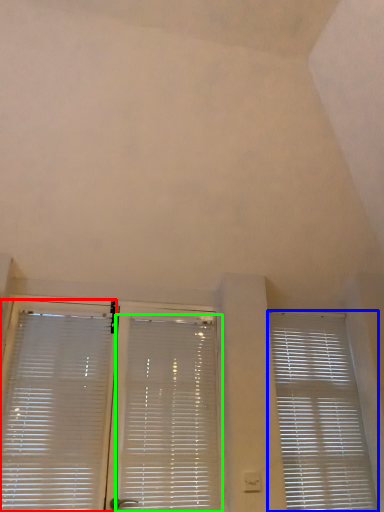
Question: Which object is the closest to the window blind (highlighted by a red box)? Choose among these: window blind (highlighted by a blue box) or window blind (highlighted by a green box).

Choices:
 (A) window blind
 (B) window blind

Answer: (B)